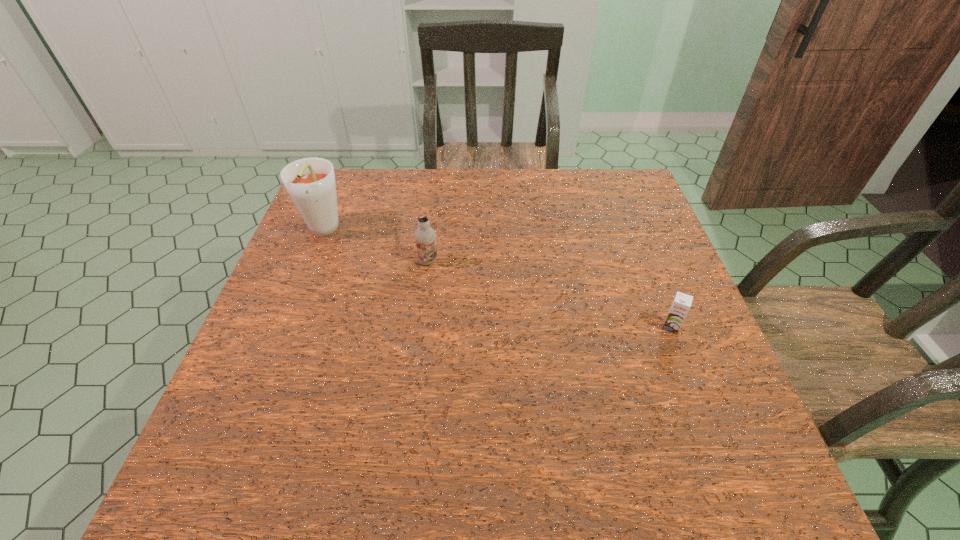
Locate which object is the closest to the tallest object. Please provide its 2D coordinates. Your answer should be formatted as a tuple, i.e. [(x, y)], where the tuple contains the x and y coordinates of a point satisfying the conditions above.

[(425, 236)]

Identify the location of the second closest object to the rightmost object. tap(310, 182).

You are a GUI agent. You are given a task and a screenshot of the screen. Output one action in this format:
    pyautogui.click(x=<x>, y=<y>)
    Task: Click on the free location that satisfies the following two spatial constraints: 1. on the drink side of the shorter chocolate milk; 2. on the left side of the root beer
    This screenshot has width=960, height=540.
    Given the screenshot: What is the action you would take?
    pyautogui.click(x=285, y=327)

Where is `blank space that satisfies the following two spatial constraints: 1. on the drink side of the nearest object; 2. on the left side of the farthest object`? This screenshot has width=960, height=540. blank space that satisfies the following two spatial constraints: 1. on the drink side of the nearest object; 2. on the left side of the farthest object is located at coordinates tap(285, 327).

What are the coordinates of `vacant space that satisfies the following two spatial constraints: 1. on the drink side of the tallest object; 2. on the right side of the farther chocolate milk` in the screenshot? It's located at (311, 261).

You are a GUI agent. You are given a task and a screenshot of the screen. Output one action in this format:
    pyautogui.click(x=<x>, y=<y>)
    Task: Click on the free spot that satisfies the following two spatial constraints: 1. on the drink side of the farthest object; 2. on the left side of the second tallest object
    Image resolution: width=960 pixels, height=540 pixels.
    Given the screenshot: What is the action you would take?
    pyautogui.click(x=311, y=261)

At what (x,y) coordinates should I click in order to perform the action: click on free space that satisfies the following two spatial constraints: 1. on the drink side of the taller chocolate milk; 2. on the left side of the leftmost object. Please return your answer as a coordinate pair (x, y). Looking at the image, I should click on (311, 261).

You are a GUI agent. You are given a task and a screenshot of the screen. Output one action in this format:
    pyautogui.click(x=<x>, y=<y>)
    Task: Click on the free point that satisfies the following two spatial constraints: 1. on the drink side of the nearer chocolate milk; 2. on the left side of the farthest object
    
    Given the screenshot: What is the action you would take?
    pyautogui.click(x=285, y=327)

Identify the location of vacant space that satisfies the following two spatial constraints: 1. on the drink side of the second farthest object; 2. on the right side of the tallest object. (311, 261).

Find the location of a particular element. The image size is (960, 540). free space that satisfies the following two spatial constraints: 1. on the drink side of the leftmost object; 2. on the right side of the farther chocolate milk is located at coordinates (311, 261).